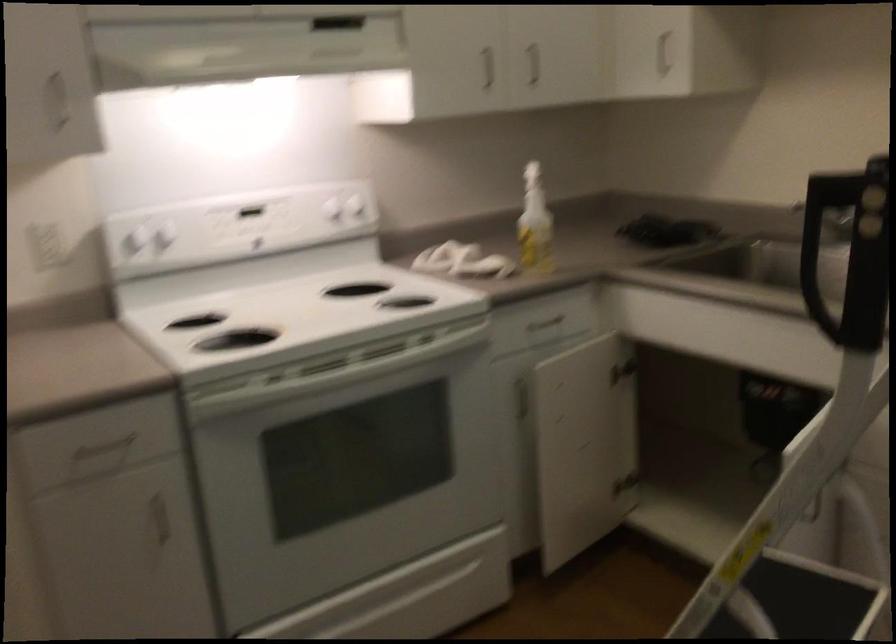
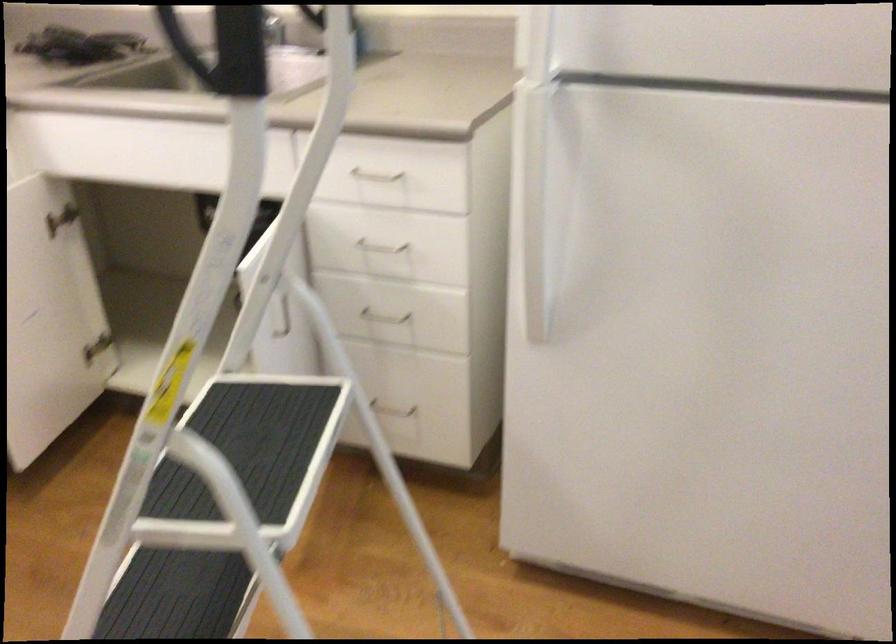
Question: The camera is either moving clockwise (left) or counter-clockwise (right) around the object. The first image is from the beginning of the video and the second image is from the end. Is the camera moving left or right when shooting the video?

Choices:
 (A) Left
 (B) Right

Answer: (A)